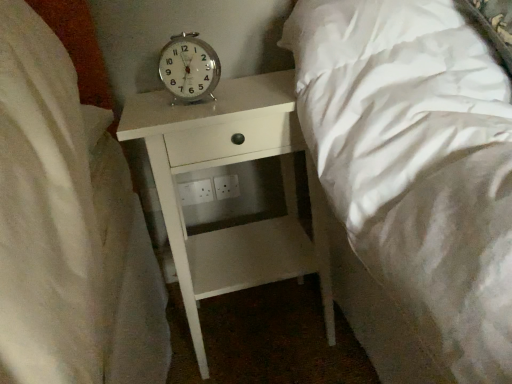
Question: Do you think white matte nightstand at center is within metallic silver alarm clock at center, or outside of it?

Choices:
 (A) outside
 (B) inside

Answer: (A)

Question: In terms of width, does white matte nightstand at center look wider or thinner when compared to metallic silver alarm clock at center?

Choices:
 (A) thin
 (B) wide

Answer: (B)

Question: From a real-world perspective, is white matte nightstand at center physically located above or below metallic silver alarm clock at center?

Choices:
 (A) below
 (B) above

Answer: (A)

Question: From the image's perspective, is metallic silver alarm clock at center located above or below white matte nightstand at center?

Choices:
 (A) above
 (B) below

Answer: (A)

Question: Considering the positions of metallic silver alarm clock at center and white matte nightstand at center in the image, is metallic silver alarm clock at center wider or thinner than white matte nightstand at center?

Choices:
 (A) wide
 (B) thin

Answer: (B)

Question: From a real-world perspective, is metallic silver alarm clock at center physically located above or below white matte nightstand at center?

Choices:
 (A) below
 (B) above

Answer: (B)

Question: Considering the positions of metallic silver alarm clock at center and white matte nightstand at center in the image, is metallic silver alarm clock at center taller or shorter than white matte nightstand at center?

Choices:
 (A) short
 (B) tall

Answer: (A)